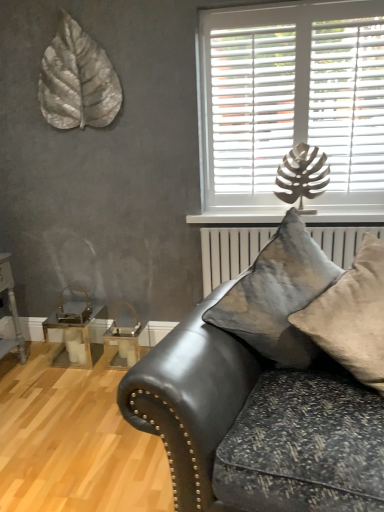
Question: Can you confirm if textured beige pillow at center, the second pillow from the left, is taller than metallic silver leaf at upper left?

Choices:
 (A) yes
 (B) no

Answer: (B)

Question: Can you confirm if textured beige pillow at center, the second pillow from the left, is bigger than metallic silver leaf at upper left?

Choices:
 (A) no
 (B) yes

Answer: (B)

Question: Is textured beige pillow at center, the second pillow from the left, to the right of metallic silver leaf at upper left from the viewer's perspective?

Choices:
 (A) yes
 (B) no

Answer: (A)

Question: From a real-world perspective, is textured beige pillow at center, the second pillow from the left, beneath metallic silver leaf at upper left?

Choices:
 (A) yes
 (B) no

Answer: (A)

Question: Is textured beige pillow at center, the second pillow from the left, oriented towards metallic silver leaf at upper left?

Choices:
 (A) yes
 (B) no

Answer: (B)

Question: From the image's perspective, is velvet gray pillow at center, which is the 2th pillow in right-to-left order, above or below metallic gold table at lower left, placed as the second table when sorted from right to left?

Choices:
 (A) below
 (B) above

Answer: (B)

Question: Is velvet gray pillow at center, the first pillow positioned from the left, bigger or smaller than metallic gold table at lower left, which is counted as the first table, starting from the left?

Choices:
 (A) big
 (B) small

Answer: (A)

Question: Is velvet gray pillow at center, the first pillow positioned from the left, spatially inside metallic gold table at lower left, placed as the second table when sorted from right to left, or outside of it?

Choices:
 (A) inside
 (B) outside

Answer: (B)

Question: Considering the relative positions of velvet gray pillow at center, which is the 2th pillow in right-to-left order, and metallic gold table at lower left, placed as the second table when sorted from right to left, in the image provided, is velvet gray pillow at center, which is the 2th pillow in right-to-left order, to the left or to the right of metallic gold table at lower left, placed as the second table when sorted from right to left,?

Choices:
 (A) right
 (B) left

Answer: (A)

Question: Based on their sizes in the image, would you say white plastic blinds at upper right is bigger or smaller than metallic gold table at lower left, placed as the second table when sorted from right to left?

Choices:
 (A) big
 (B) small

Answer: (A)

Question: From a real-world perspective, is white plastic blinds at upper right physically located above or below metallic gold table at lower left, which is counted as the first table, starting from the left?

Choices:
 (A) below
 (B) above

Answer: (B)

Question: Considering the positions of point (372, 60) and point (94, 314), is point (372, 60) closer or farther from the camera than point (94, 314)?

Choices:
 (A) farther
 (B) closer

Answer: (B)

Question: Based on their positions, is white plastic blinds at upper right located to the left or right of metallic gold table at lower left, placed as the second table when sorted from right to left?

Choices:
 (A) right
 (B) left

Answer: (A)

Question: Considering their positions, is clear glass table at lower left, which appears as the first table when viewed from the right, located in front of or behind metallic silver leaf at upper left?

Choices:
 (A) behind
 (B) front

Answer: (A)

Question: Considering the relative positions of clear glass table at lower left, the second table in the left-to-right sequence, and metallic silver leaf at upper left in the image provided, is clear glass table at lower left, the second table in the left-to-right sequence, to the left or to the right of metallic silver leaf at upper left?

Choices:
 (A) left
 (B) right

Answer: (B)